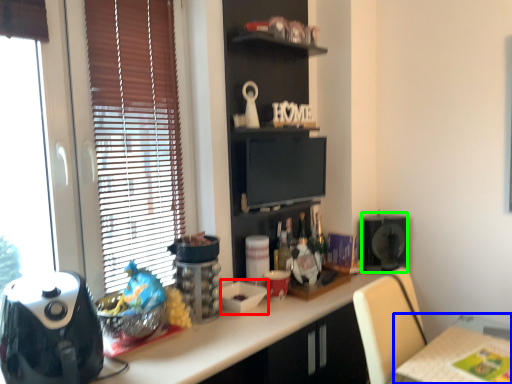
Question: Based on their relative distances, which object is nearer to appliance (highlighted by a red box)? Choose from table (highlighted by a blue box) and appliance (highlighted by a green box).

Choices:
 (A) table
 (B) appliance

Answer: (A)